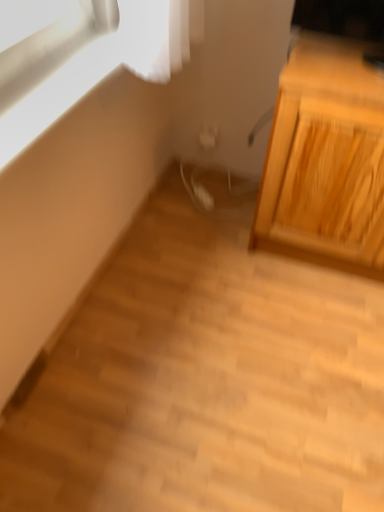
Locate an element on the screen. This screenshot has width=384, height=512. vacant region to the left of light wood cabinet at right is located at coordinates (210, 234).